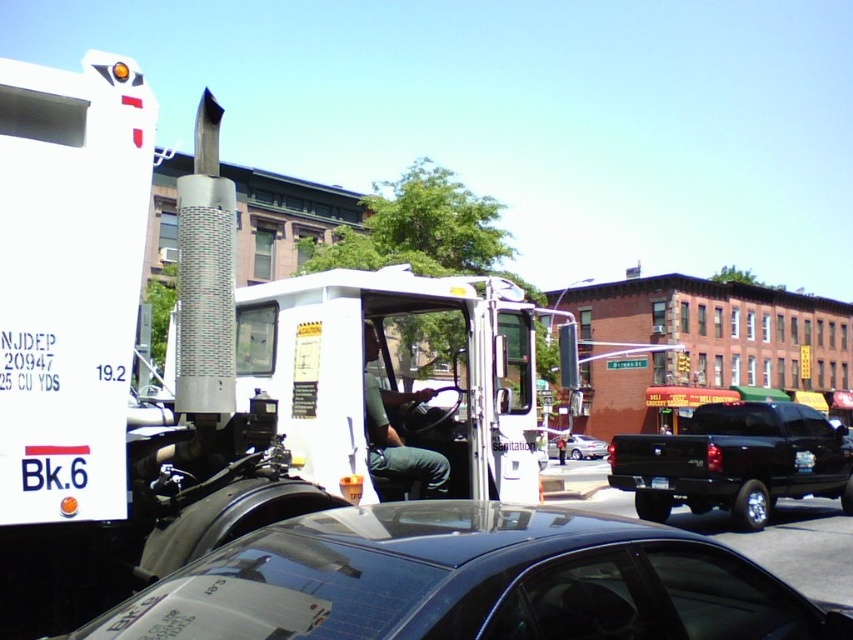
You are standing in front of the white sanitation truck NJDEP 20947. There are two points marked on the truck. The first point is at coordinates point [300,541] and the second point is at point [637,444]. Which point is closer to you?

Point [300,541] is closer to the viewer than point [637,444].

You are a delivery driver who needs to park your 2.5 meter wide van between the black matte truck at right and the shiny silver sedan at center. Can your van fit in the space between them?

The black matte truck at right is wider than the shiny silver sedan at center. Since the van is 2.5 meters wide, it might not fit if the space between them is narrower than 2.5 meters. However, without knowing the exact distance between the vehicles, it is impossible to determine if the van can fit.

You are standing at the point marked by the coordinates (469, 580) in the image. What object is exactly at this point?

The glossy black car at center is located at point (469, 580).